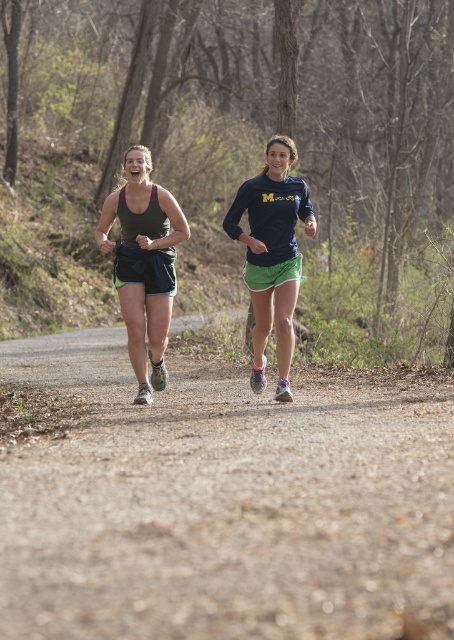
You are a photographer trying to capture a photo of both the matte black tank top at center and the matte blue shirt at center. Since you want to focus on the one closer to you, which one should you adjust your camera to focus on?

The matte black tank top at center is closer to the viewer than the matte blue shirt at center, so you should adjust your camera to focus on the matte black tank top at center.